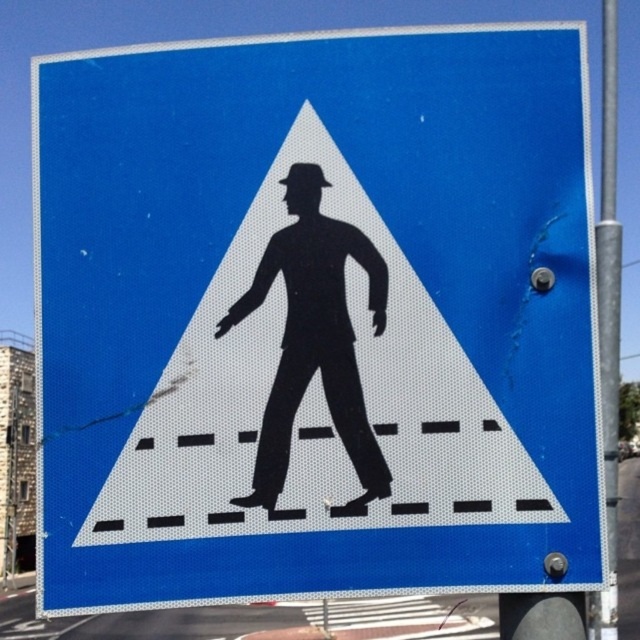
Question: Does black matte figure at center have a lesser width compared to metallic gray pole at right?

Choices:
 (A) no
 (B) yes

Answer: (B)

Question: Is black matte figure at center behind metallic gray pole at right?

Choices:
 (A) no
 (B) yes

Answer: (A)

Question: Which point appears farthest from the camera in this image?

Choices:
 (A) (305, 369)
 (B) (616, 429)

Answer: (B)

Question: Which of the following is the closest to the observer?

Choices:
 (A) black matte figure at center
 (B) metallic gray pole at right

Answer: (A)

Question: Among these points, which one is farthest from the camera?

Choices:
 (A) (616, 122)
 (B) (330, 282)

Answer: (A)

Question: Does black matte figure at center come in front of metallic gray pole at right?

Choices:
 (A) yes
 (B) no

Answer: (A)